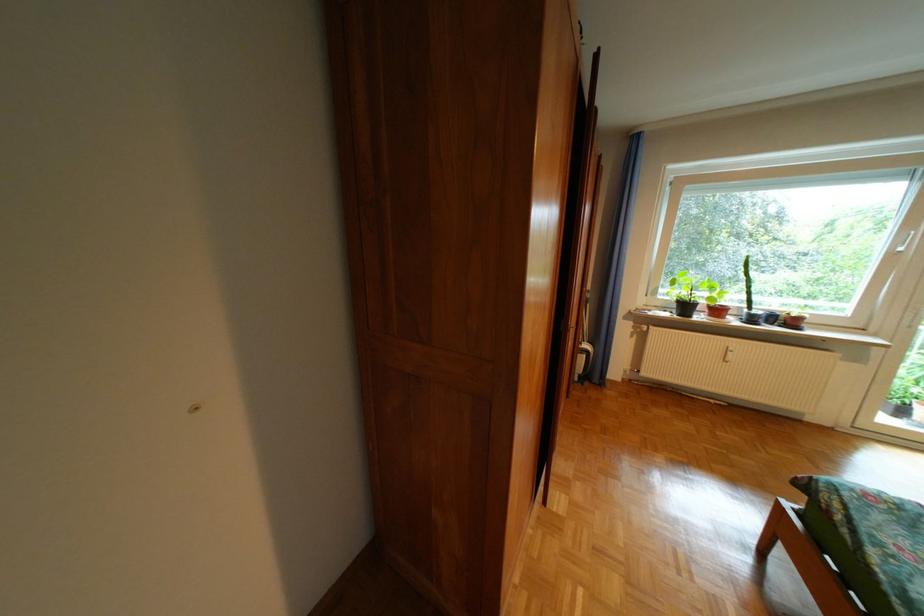
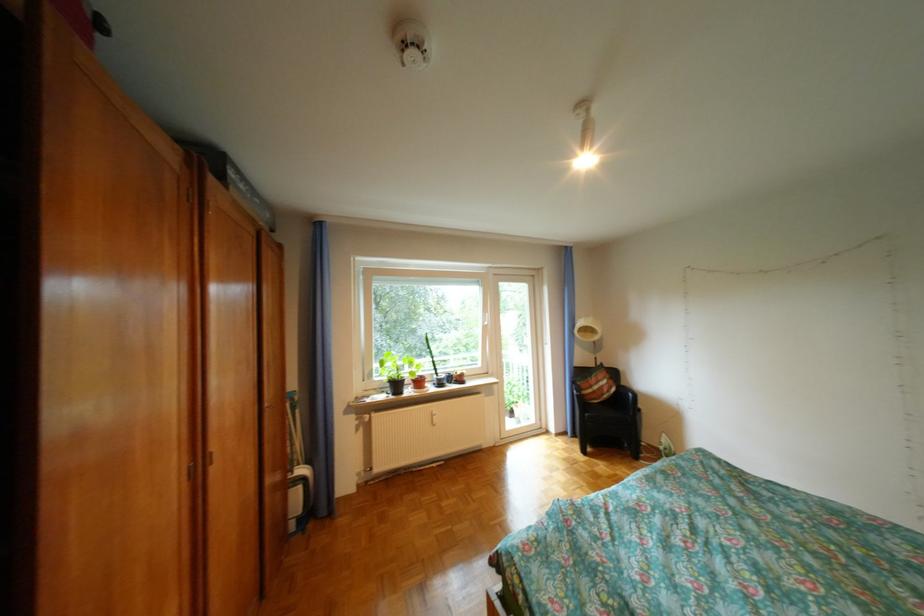
Where in the second image is the point corresponding to [601,347] from the first image?

(317, 471)